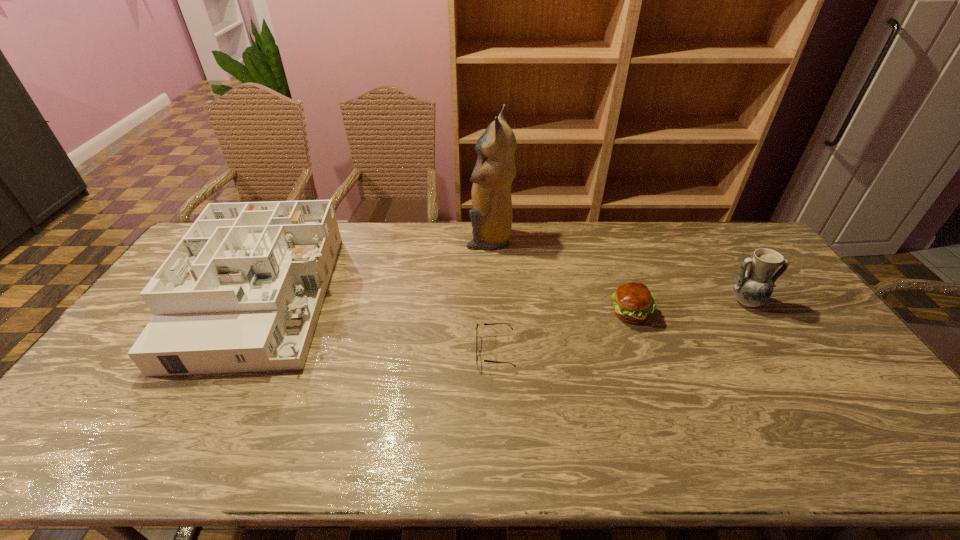
You are a GUI agent. You are given a task and a screenshot of the screen. Output one action in this format:
    pyautogui.click(x=<x>, y=<y>)
    Task: Click on the free location located on the right of the leftmost object
    The image size is (960, 540).
    Given the screenshot: What is the action you would take?
    pyautogui.click(x=406, y=298)

Where is `vacant space positioned on the front of the second object from right to left`? The height and width of the screenshot is (540, 960). vacant space positioned on the front of the second object from right to left is located at coordinates (646, 359).

Locate an element on the screen. The height and width of the screenshot is (540, 960). vacant region located 0.290m on the front-facing side of the shortest object is located at coordinates (372, 351).

Where is `vacant space located 0.050m on the front-facing side of the shortest object`? This screenshot has width=960, height=540. vacant space located 0.050m on the front-facing side of the shortest object is located at coordinates (458, 351).

Identify the location of free space located on the front-facing side of the shortest object. The width and height of the screenshot is (960, 540). (347, 351).

Find the location of a particular element. This screenshot has height=540, width=960. cat that is at the far edge is located at coordinates (491, 216).

I want to click on dollhouse at the far edge, so click(x=242, y=291).

At what (x,y) coordinates should I click in order to perform the action: click on object that is at the left edge. Please return your answer as a coordinate pair (x, y). The image size is (960, 540). Looking at the image, I should click on (242, 291).

Image resolution: width=960 pixels, height=540 pixels. I want to click on object that is at the right edge, so click(x=752, y=288).

The image size is (960, 540). Identify the location of object that is at the far left corner. (242, 291).